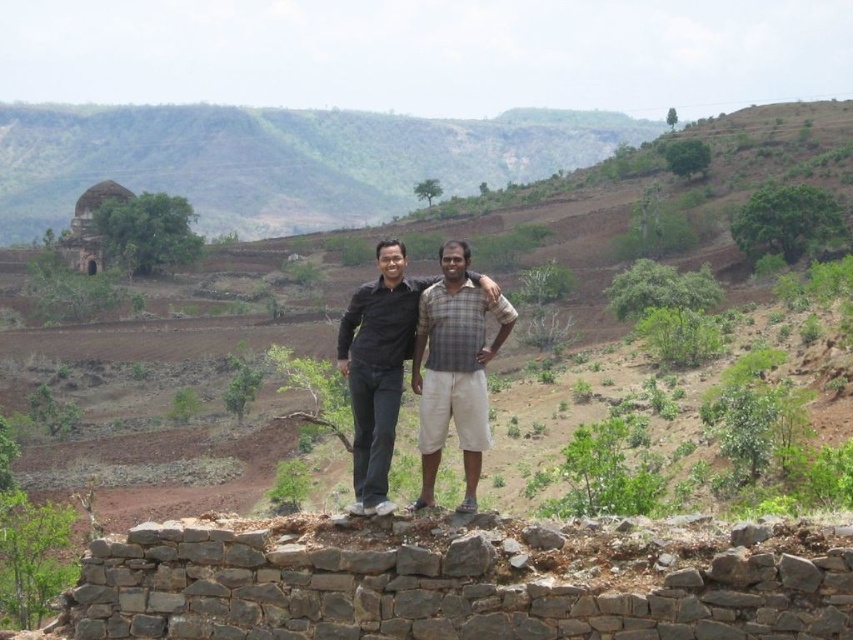
Looking at this image, you are a photographer trying to capture a landscape shot of the brown earthy hillside at center. You want to position your camera so that the hillside is exactly at the center of your frame. Given that the camera has a fixed focus point at coordinates 0.5, 0.5, will the hillside be in focus?

The 2D location of brown earthy hillside at center is at point (350, 292), which is slightly to the left and below the camera focus point at (426, 320). Therefore, the hillside will not be perfectly centered in the frame.

You are a photographer trying to capture the two points in the image. Which point, point (32, 342) or point (302, 214), is positioned closer to your camera lens?

Point (32, 342) is closer to the viewer than point (302, 214), so it is positioned closer to the camera lens.

You are a photographer trying to capture a photo of the matte black shirt at center and the brown earthy hillside at center. Which object is positioned higher in the frame?

The brown earthy hillside at center is above the matte black shirt at center in the frame.